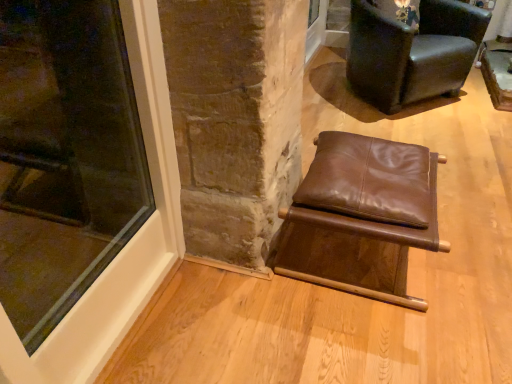
Question: Is dark brown leather chair at upper right, positioned as the 2th chair in front-to-back order, smaller than brown leather stool at center, marked as the 1th chair in a bottom-to-top arrangement?

Choices:
 (A) yes
 (B) no

Answer: (B)

Question: Can you confirm if dark brown leather chair at upper right, the second chair when ordered from bottom to top, is positioned to the left of brown leather stool at center, the 1th chair from the front?

Choices:
 (A) yes
 (B) no

Answer: (B)

Question: Does dark brown leather chair at upper right, which appears as the first chair when viewed from the top, lie behind brown leather stool at center, the 1th chair from the front?

Choices:
 (A) yes
 (B) no

Answer: (A)

Question: Considering the relative sizes of dark brown leather chair at upper right, which appears as the first chair when viewed from the top, and brown leather stool at center, the second chair from the top, in the image provided, is dark brown leather chair at upper right, which appears as the first chair when viewed from the top, bigger than brown leather stool at center, the second chair from the top,?

Choices:
 (A) no
 (B) yes

Answer: (B)

Question: Is dark brown leather chair at upper right, placed as the first chair when sorted from back to front, with brown leather stool at center, marked as the 1th chair in a bottom-to-top arrangement?

Choices:
 (A) yes
 (B) no

Answer: (B)

Question: Does dark brown leather chair at upper right, placed as the first chair when sorted from back to front, have a lesser width compared to brown leather stool at center, marked as the 1th chair in a bottom-to-top arrangement?

Choices:
 (A) yes
 (B) no

Answer: (B)

Question: Can you confirm if brown leather stool at center, the second chair from the top, is shorter than dark brown leather chair at upper right, placed as the first chair when sorted from back to front?

Choices:
 (A) no
 (B) yes

Answer: (B)

Question: Is brown leather stool at center, the 1th chair from the front, positioned with its back to dark brown leather chair at upper right, positioned as the 2th chair in front-to-back order?

Choices:
 (A) yes
 (B) no

Answer: (B)

Question: Considering the relative sizes of brown leather stool at center, marked as the 2th chair in a back-to-front arrangement, and dark brown leather chair at upper right, the second chair when ordered from bottom to top, in the image provided, is brown leather stool at center, marked as the 2th chair in a back-to-front arrangement, smaller than dark brown leather chair at upper right, the second chair when ordered from bottom to top,?

Choices:
 (A) yes
 (B) no

Answer: (A)

Question: From the image's perspective, does brown leather stool at center, the 1th chair from the front, appear higher than dark brown leather chair at upper right, which appears as the first chair when viewed from the top?

Choices:
 (A) yes
 (B) no

Answer: (B)

Question: Considering the relative positions of brown leather stool at center, the second chair from the top, and dark brown leather chair at upper right, which appears as the first chair when viewed from the top, in the image provided, is brown leather stool at center, the second chair from the top, to the left of dark brown leather chair at upper right, which appears as the first chair when viewed from the top, from the viewer's perspective?

Choices:
 (A) no
 (B) yes

Answer: (B)

Question: Is brown leather stool at center, the 1th chair from the front, further to the viewer compared to dark brown leather chair at upper right, which appears as the first chair when viewed from the top?

Choices:
 (A) yes
 (B) no

Answer: (B)

Question: Is the position of transparent glass window at lower left more distant than that of dark brown leather chair at upper right, which appears as the first chair when viewed from the top?

Choices:
 (A) no
 (B) yes

Answer: (A)